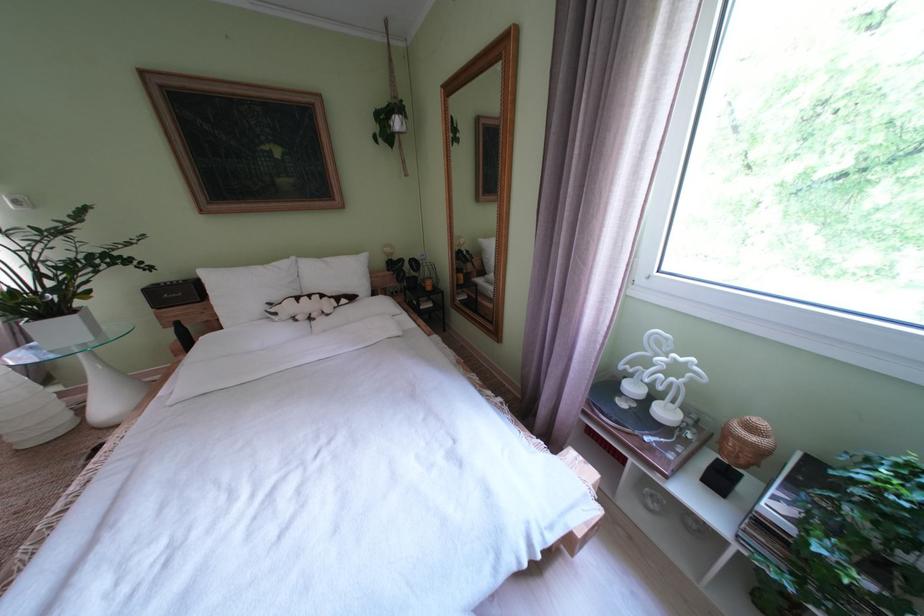
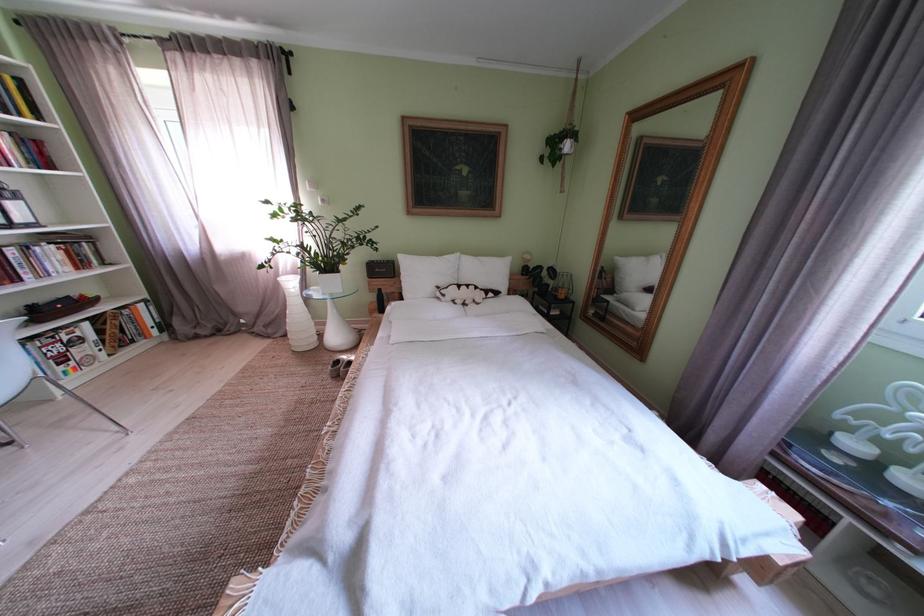
In the second image, find the point that corresponds to (x=286, y=318) in the first image.

(455, 301)